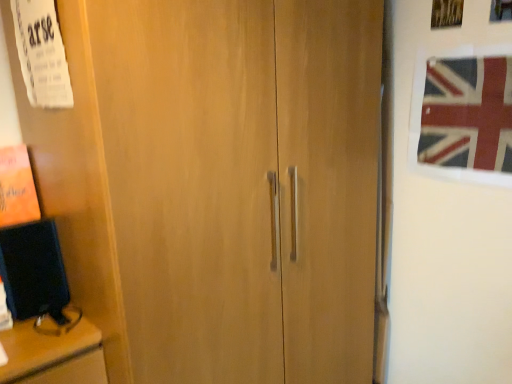
Question: Is white paper at upper left far from union jack fabric at upper right?

Choices:
 (A) no
 (B) yes

Answer: (B)

Question: Considering the relative sizes of white paper at upper left and union jack fabric at upper right in the image provided, is white paper at upper left taller than union jack fabric at upper right?

Choices:
 (A) no
 (B) yes

Answer: (B)

Question: Is white paper at upper left surrounding union jack fabric at upper right?

Choices:
 (A) yes
 (B) no

Answer: (B)

Question: Considering the relative sizes of white paper at upper left and union jack fabric at upper right in the image provided, is white paper at upper left smaller than union jack fabric at upper right?

Choices:
 (A) yes
 (B) no

Answer: (B)

Question: From the image's perspective, is white paper at upper left on top of union jack fabric at upper right?

Choices:
 (A) yes
 (B) no

Answer: (A)

Question: Is white paper at upper left in front of union jack fabric at upper right?

Choices:
 (A) yes
 (B) no

Answer: (A)

Question: Is union jack fabric at upper right directly adjacent to white paper at upper left?

Choices:
 (A) yes
 (B) no

Answer: (B)

Question: Is union jack fabric at upper right to the left of white paper at upper left from the viewer's perspective?

Choices:
 (A) no
 (B) yes

Answer: (A)

Question: Does union jack fabric at upper right lie in front of white paper at upper left?

Choices:
 (A) no
 (B) yes

Answer: (A)

Question: From the image's perspective, would you say union jack fabric at upper right is positioned over white paper at upper left?

Choices:
 (A) yes
 (B) no

Answer: (B)

Question: From the image's perspective, is union jack fabric at upper right beneath white paper at upper left?

Choices:
 (A) no
 (B) yes

Answer: (B)

Question: Is union jack fabric at upper right shorter than white paper at upper left?

Choices:
 (A) yes
 (B) no

Answer: (A)

Question: From a real-world perspective, is white paper at upper left positioned above or below union jack fabric at upper right?

Choices:
 (A) below
 (B) above

Answer: (B)